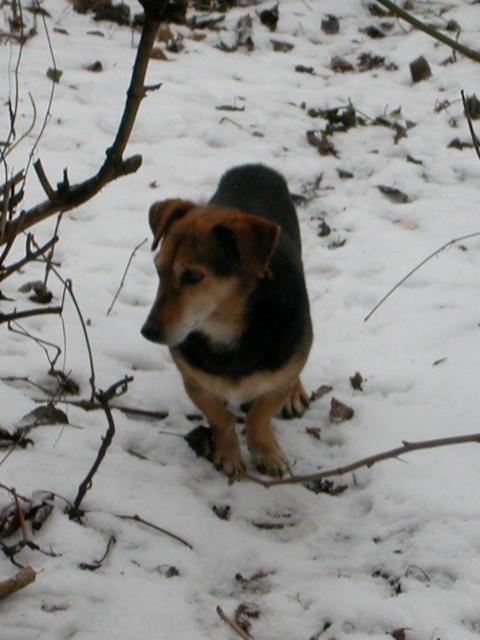
Consider the image. Is brown fur dog at center behind brown woody branch at lower center?

Yes, it is behind brown woody branch at lower center.

Is brown fur dog at center wider than brown woody branch at lower center?

Yes, brown fur dog at center is wider than brown woody branch at lower center.

Describe the element at coordinates (235, 308) in the screenshot. Image resolution: width=480 pixels, height=640 pixels. I see `brown fur dog at center` at that location.

You are a GUI agent. You are given a task and a screenshot of the screen. Output one action in this format:
    pyautogui.click(x=<x>, y=<y>)
    Task: Click on the brown fur dog at center
    The image size is (480, 640).
    Given the screenshot: What is the action you would take?
    pyautogui.click(x=235, y=308)